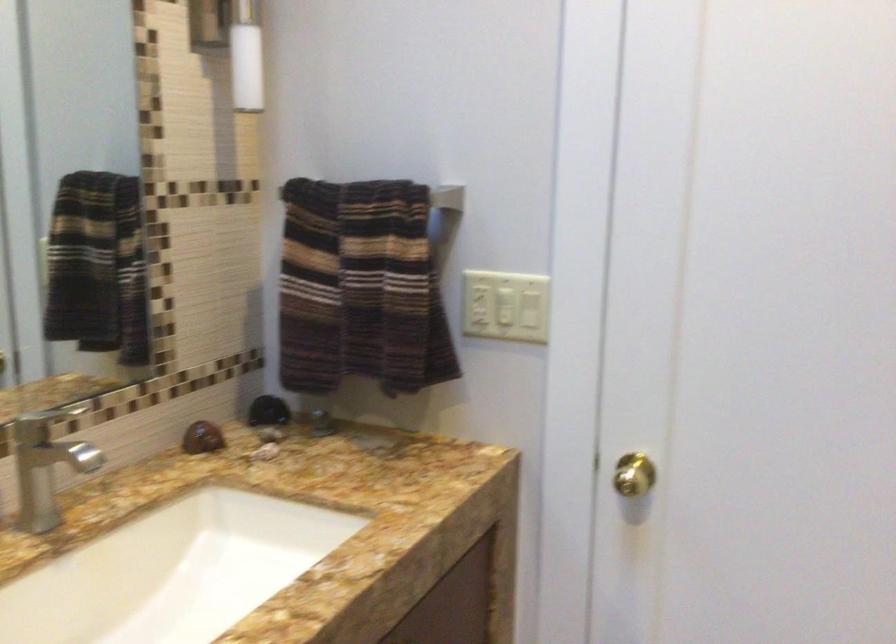
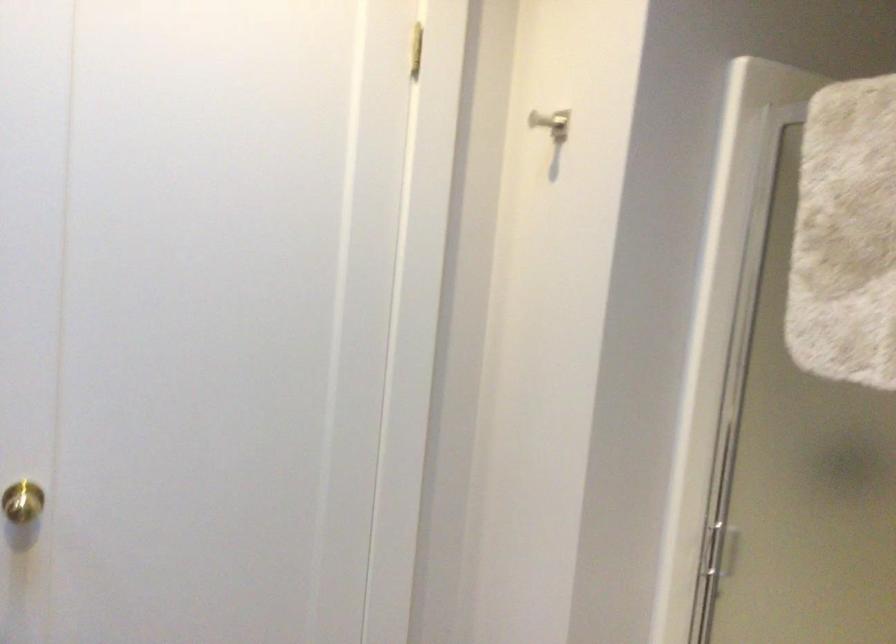
Question: The camera is either moving clockwise (left) or counter-clockwise (right) around the object. The first image is from the beginning of the video and the second image is from the end. Is the camera moving left or right when shooting the video?

Choices:
 (A) Left
 (B) Right

Answer: (A)